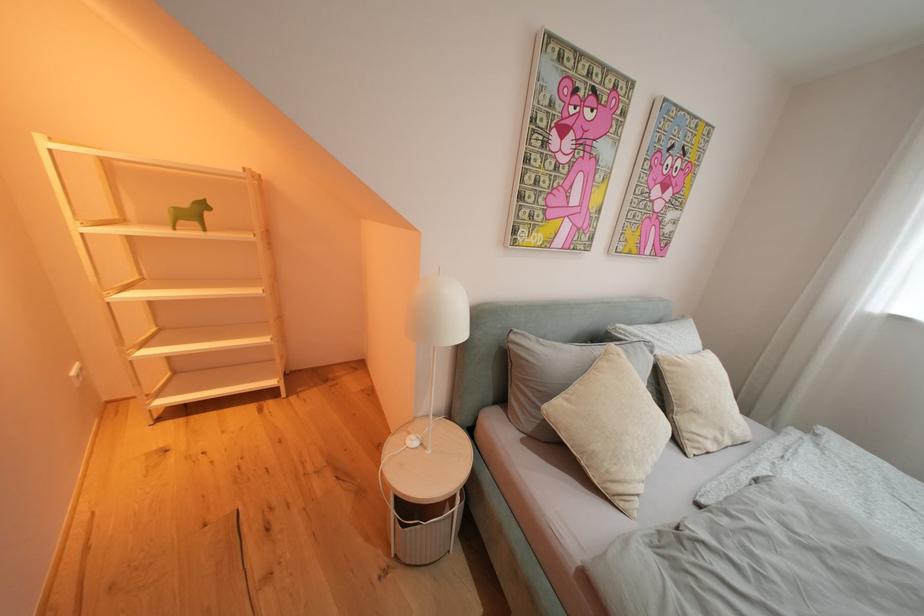
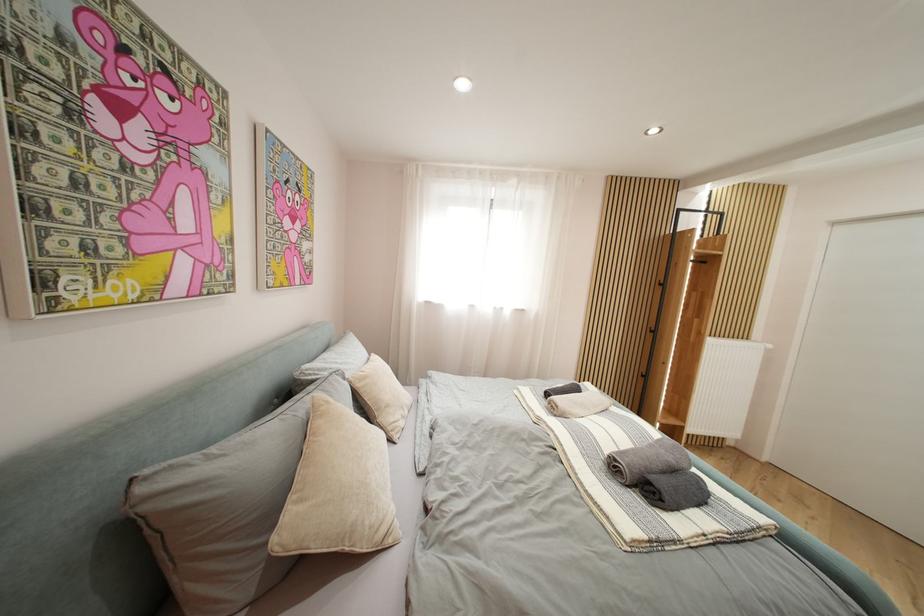
Question: The images are taken continuously from a first-person perspective. In which direction is your viewpoint rotating?

Choices:
 (A) Left
 (B) Right
 (C) Up
 (D) Down

Answer: (B)